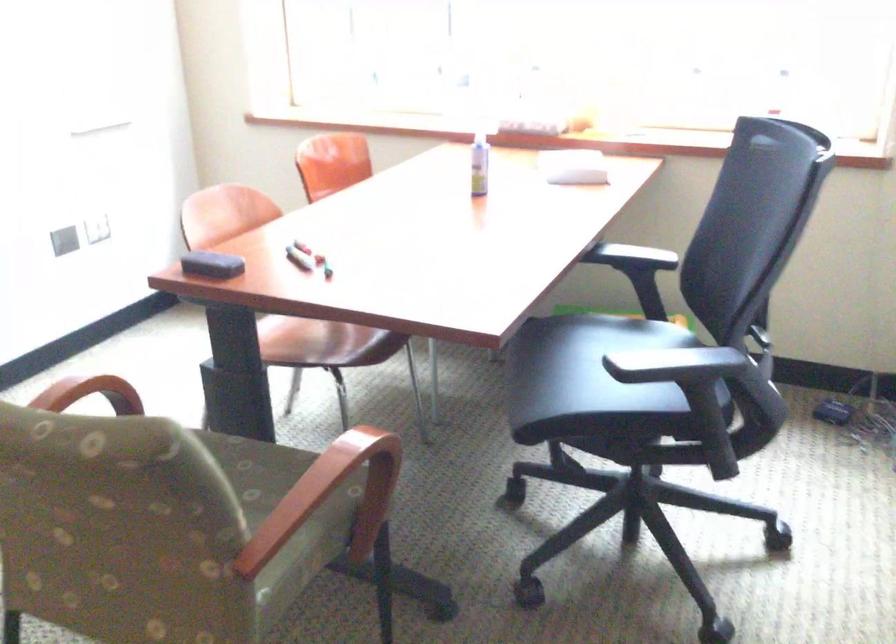
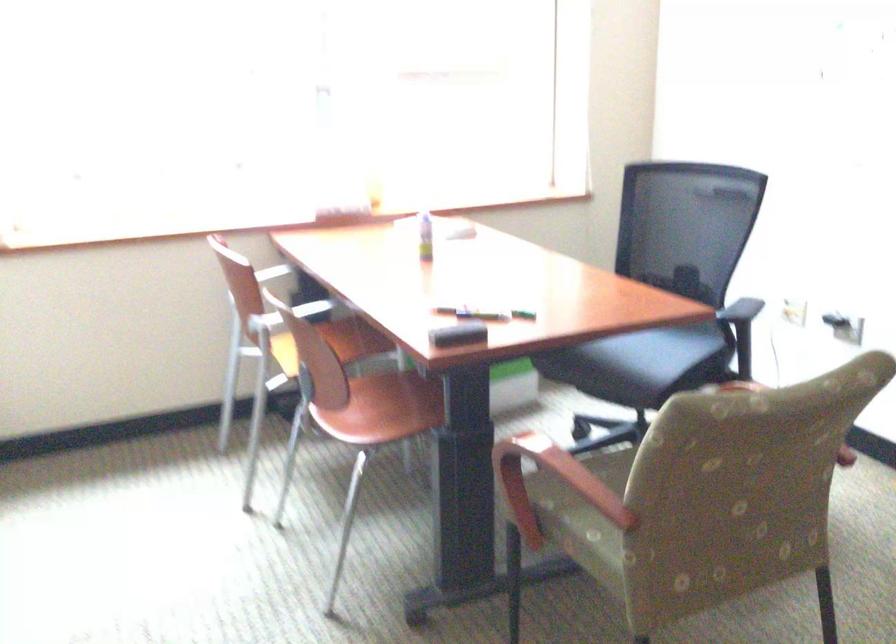
Question: I am providing you with two images of the same scene from different viewpoints. Please identify which objects are invisible in image2.

Choices:
 (A) glass jar with label
 (B) wooden chair armrest
 (C) black board eraser
 (D) chair sitting surface

Answer: (B)